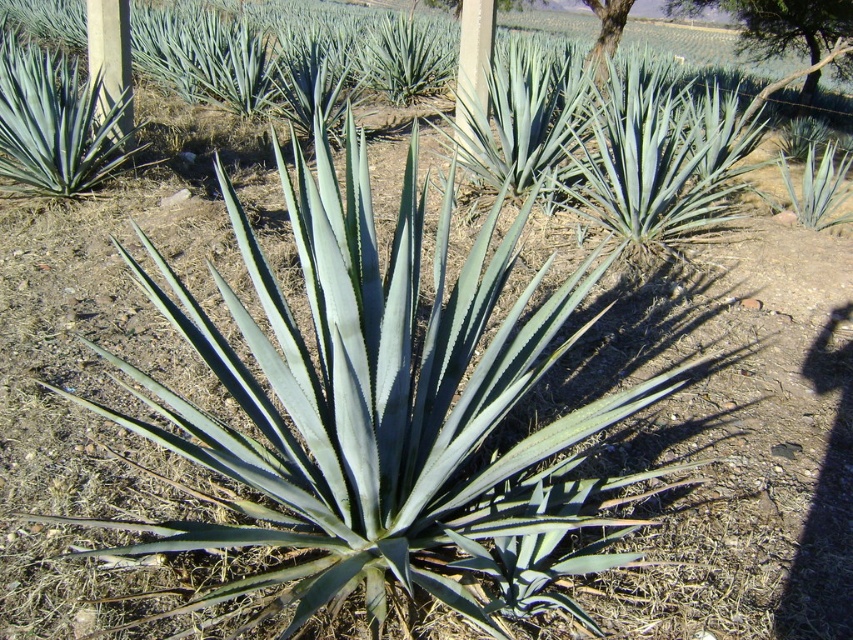
Question: Among these objects, which one is farthest from the camera?

Choices:
 (A) green leafy tree at upper right
 (B) smooth wood pole at center

Answer: (A)

Question: Where is smooth wood pole at center located in relation to smooth bark tree at upper right in the image?

Choices:
 (A) below
 (B) above

Answer: (A)

Question: Does wooden post at upper left appear on the right side of smooth wood pole at center?

Choices:
 (A) yes
 (B) no

Answer: (B)

Question: Can you confirm if green leafy tree at upper right is positioned above smooth wood pole at center?

Choices:
 (A) no
 (B) yes

Answer: (B)

Question: Based on their relative distances, which object is nearer to the wooden post at upper left?

Choices:
 (A) smooth bark tree at upper right
 (B) green leafy tree at upper right

Answer: (A)

Question: Which point appears farthest from the camera in this image?

Choices:
 (A) (463, 136)
 (B) (688, 4)

Answer: (B)